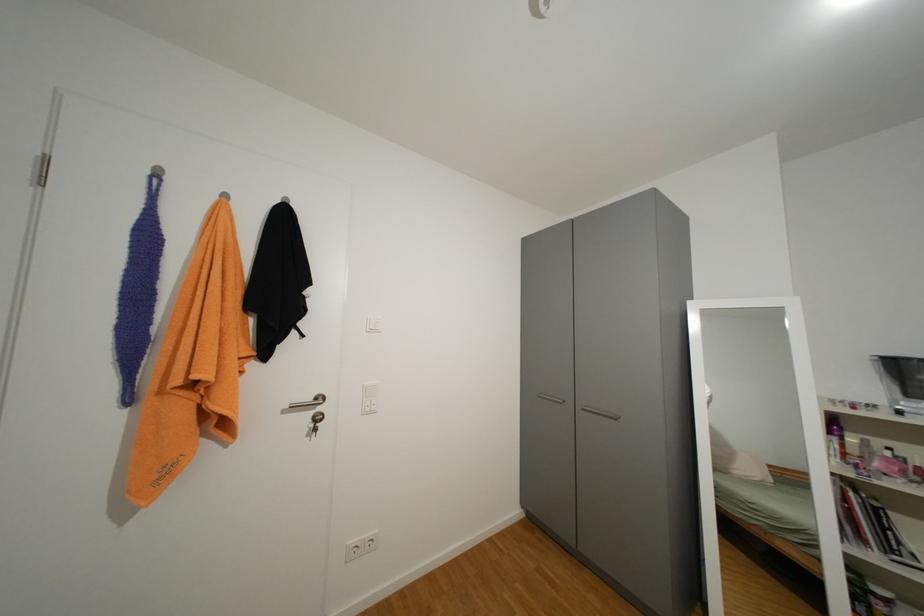
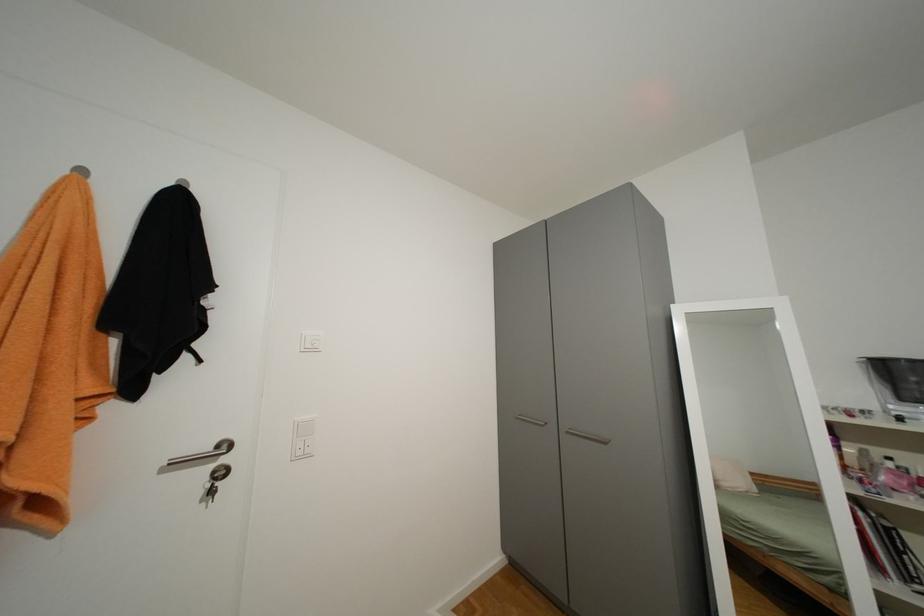
In a continuous first-person perspective shot, in which direction is the camera moving?

The cameraman moved toward right, forward.